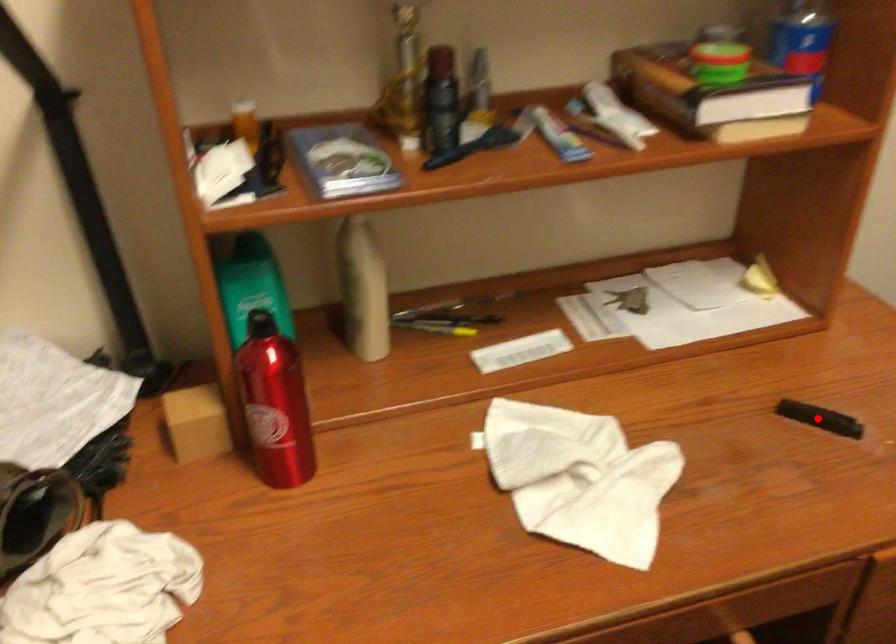
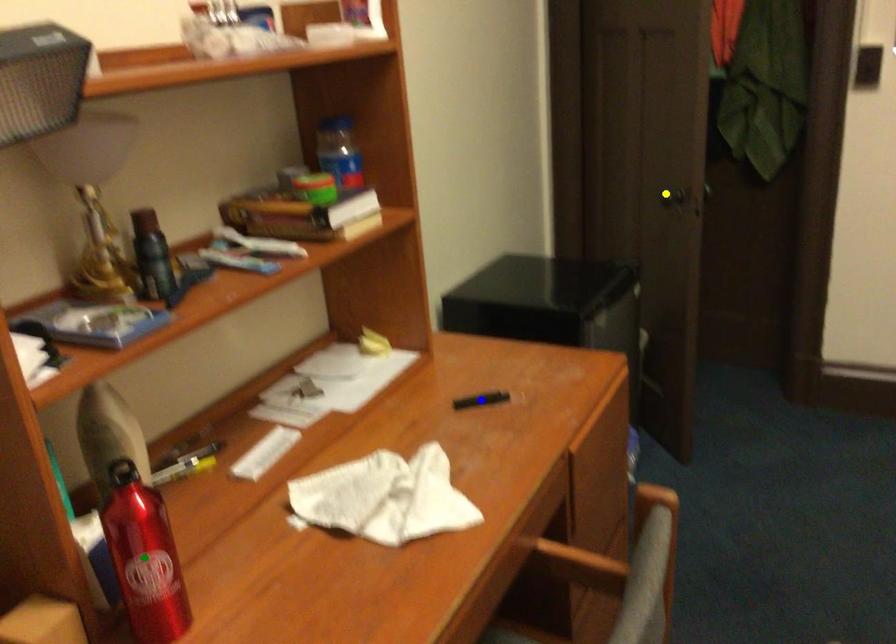
Question: I am providing you with two images of the same scene from different viewpoints. A red point is marked on the first image. You are given multiple points on the second image. Which point in image 2 represents the same 3d spot as the red point in image 1?

Choices:
 (A) blue point
 (B) yellow point
 (C) green point

Answer: (A)